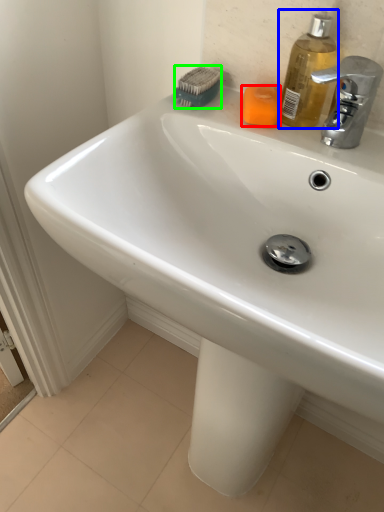
Question: Considering the real-world distances, which object is farthest from soap (highlighted by a red box)? soap dispenser (highlighted by a blue box) or brush (highlighted by a green box)?

Choices:
 (A) soap dispenser
 (B) brush

Answer: (B)